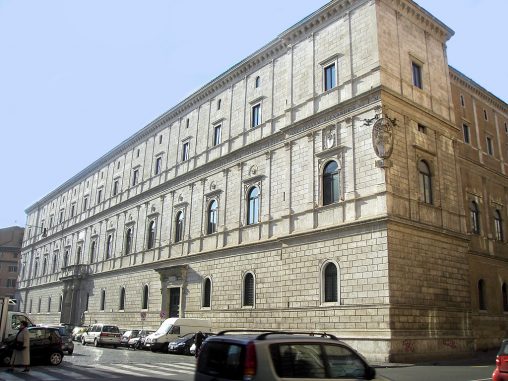
The height and width of the screenshot is (381, 508). Find the location of `doorway`. doorway is located at coordinates (173, 299).